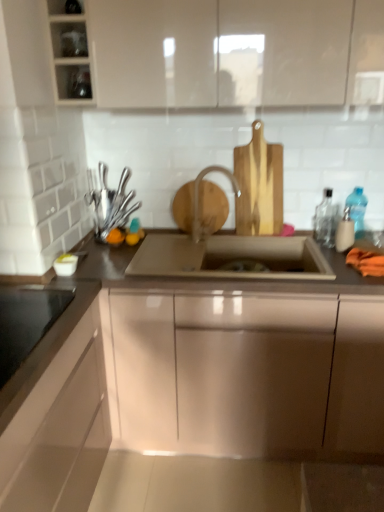
Question: Looking at their shapes, would you say transparent glass jar at upper left, arranged as the first shelf when viewed from the top, is wider or thinner than transparent plastic bottle at right, the third bottle from the left?

Choices:
 (A) thin
 (B) wide

Answer: (B)

Question: From the image's perspective, is transparent glass jar at upper left, arranged as the first shelf when viewed from the top, above or below transparent plastic bottle at right, which appears as the 1th bottle when viewed from the right?

Choices:
 (A) below
 (B) above

Answer: (B)

Question: Estimate the real-world distances between objects in this image. Which object is farther from the satin nickel sink at center?

Choices:
 (A) transparent glass jar at upper left, arranged as the first shelf when viewed from the top
 (B) transparent plastic bottle at right, the third bottle from the left
 (C) matte white cabinet at upper center, which is counted as the 1th cabinetry, starting from the top
 (D) glossy beige cabinet at lower left, which is counted as the first cabinetry, starting from the bottom
 (E) satin silver cutlery at left, which is the first appliance in back-to-front order

Answer: (A)

Question: Estimate the real-world distances between objects in this image. Which object is farther from the satin nickel faucet at center?

Choices:
 (A) black glass cooktop at lower left, arranged as the second appliance when viewed from the right
 (B) glossy beige cabinet at lower left, which is counted as the first cabinetry, starting from the bottom
 (C) translucent plastic soap dispenser at right, which appears as the second bottle when viewed from the right
 (D) transparent plastic bottle at right, which appears as the 1th bottle when viewed from the right
 (E) matte white cabinet at upper center, arranged as the third cabinetry when ordered from the bottom

Answer: (B)